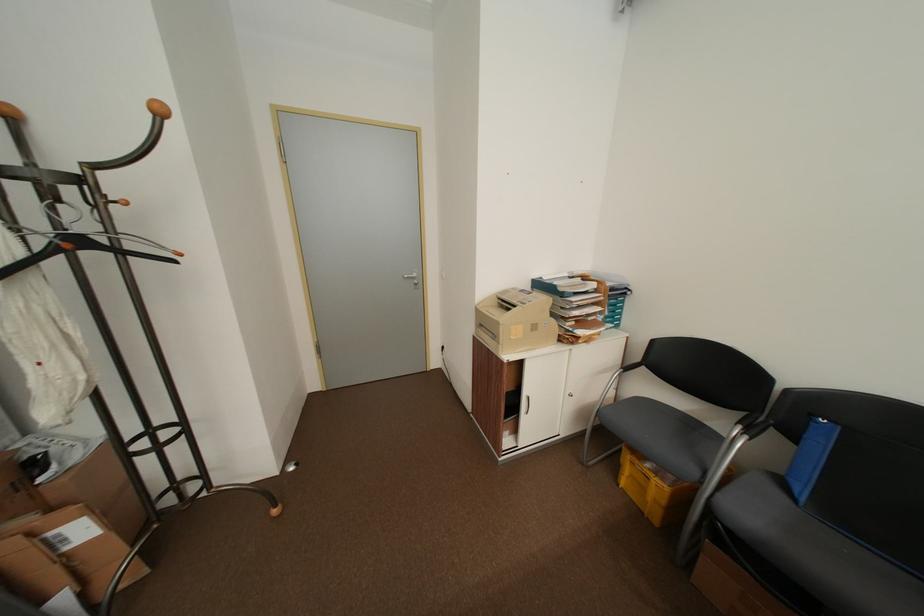
Image resolution: width=924 pixels, height=616 pixels. In order to click on recessed cabinet handle in this screenshot , I will do `click(528, 400)`.